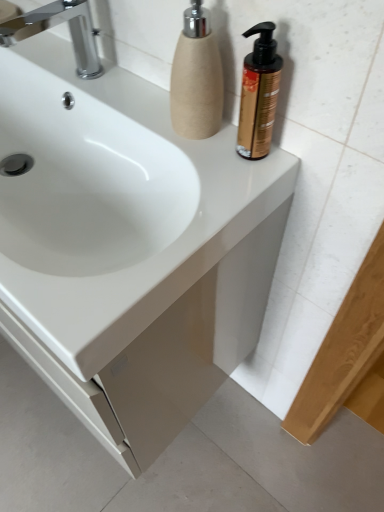
Question: Is white glossy sink at center wider or thinner than gold metallic pump bottle at upper right, the first soap dispenser in the right-to-left sequence?

Choices:
 (A) thin
 (B) wide

Answer: (B)

Question: Based on their positions, is white glossy sink at center located to the left or right of gold metallic pump bottle at upper right, the first soap dispenser in the right-to-left sequence?

Choices:
 (A) left
 (B) right

Answer: (A)

Question: Considering the real-world distances, which object is closest to the gold metallic pump bottle at upper right, the 2th soap dispenser from the left?

Choices:
 (A) white glossy sink at center
 (B) chrome metallic faucet at upper left
 (C) beige textured soap dispenser at upper right, which is the first soap dispenser in left-to-right order

Answer: (C)

Question: Which of these objects is positioned closest to the chrome metallic faucet at upper left?

Choices:
 (A) beige textured soap dispenser at upper right, which is the first soap dispenser in left-to-right order
 (B) white glossy sink at center
 (C) gold metallic pump bottle at upper right, the 2th soap dispenser from the left

Answer: (B)